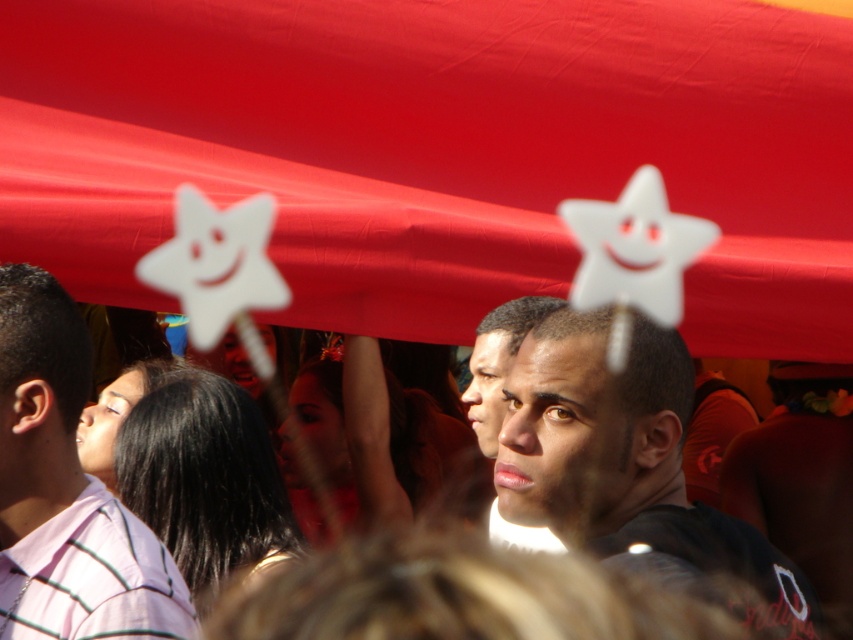
What do you see at coordinates (65, 490) in the screenshot? This screenshot has width=853, height=640. I see `pink striped shirt at left` at bounding box center [65, 490].

Is point (13, 632) behind point (495, 429)?

No, (13, 632) is in front of (495, 429).

Identify the location of pink striped shirt at left. Image resolution: width=853 pixels, height=640 pixels. (65, 490).

Between matte black shirt at center and pink striped shirt at left, which one has less height?

With less height is matte black shirt at center.

Does matte black shirt at center have a smaller size compared to pink striped shirt at left?

No, matte black shirt at center is not smaller than pink striped shirt at left.

Does point (605, 490) come behind point (38, 416)?

No, (605, 490) is closer to viewer.

Locate an element on the screen. Image resolution: width=853 pixels, height=640 pixels. matte black shirt at center is located at coordinates (627, 464).

Does point (573, 504) come farther from viewer compared to point (496, 376)?

That is False.

How far apart are matte black shirt at center and smooth skin face at center?

A distance of 3.79 feet exists between matte black shirt at center and smooth skin face at center.

Identify the location of matte black shirt at center. This screenshot has width=853, height=640. (627, 464).

The height and width of the screenshot is (640, 853). Identify the location of matte black shirt at center. (627, 464).